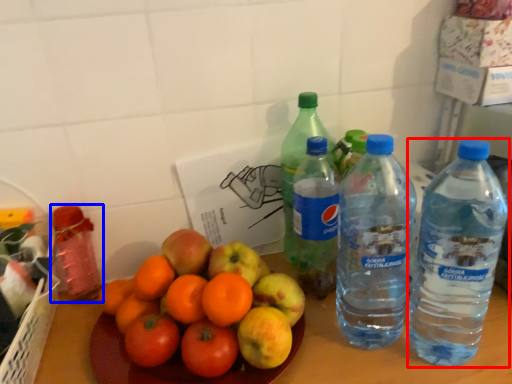
Question: Which object is closer to the camera taking this photo, bottle (highlighted by a red box) or bottle (highlighted by a blue box)?

Choices:
 (A) bottle
 (B) bottle

Answer: (A)